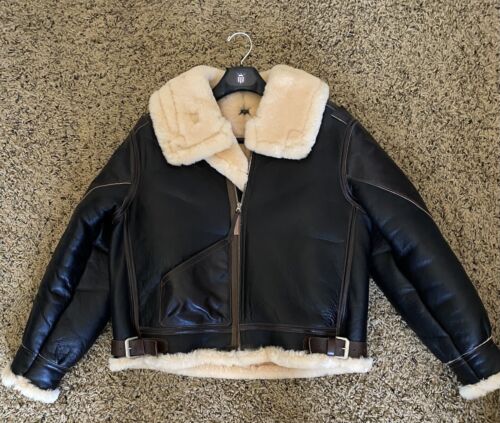
Locate an element on the screen. hanger hook is located at coordinates (240, 57).